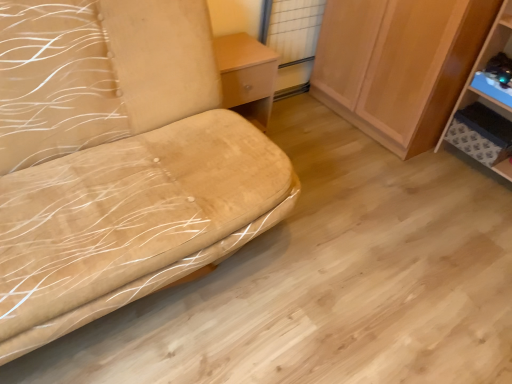
Image resolution: width=512 pixels, height=384 pixels. Identify the location of free space to the left of blue plastic shelf at right. (x=431, y=175).